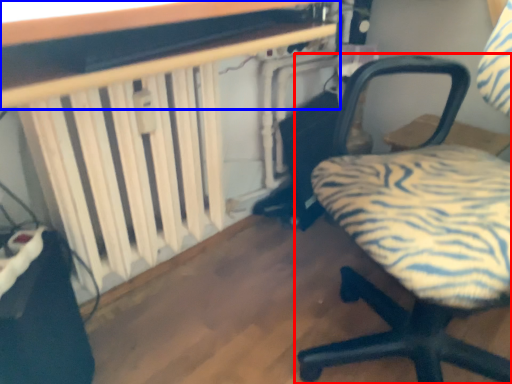
Question: Among these objects, which one is nearest to the camera, chair (highlighted by a red box) or table (highlighted by a blue box)?

Choices:
 (A) chair
 (B) table

Answer: (A)